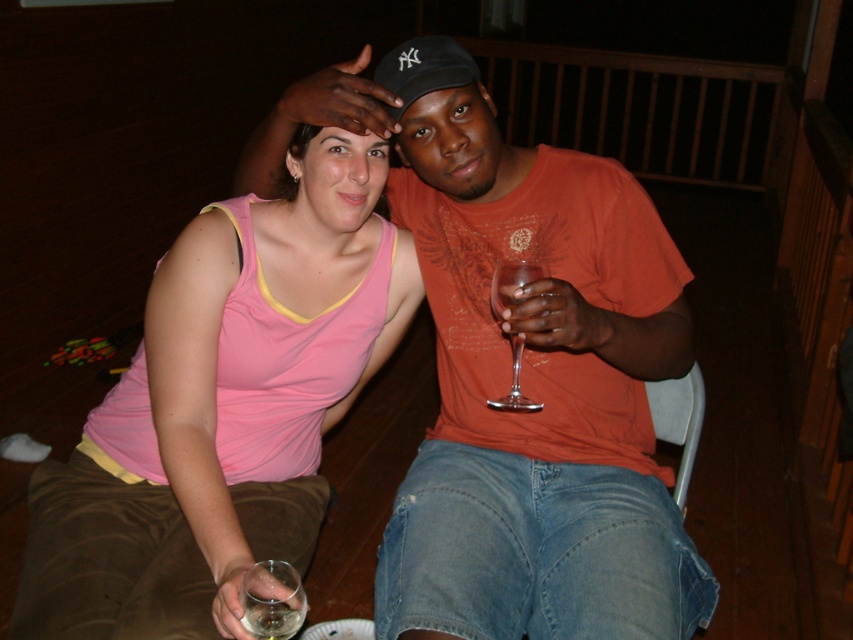
Is clear glass wine glass at lower left bigger than clear glass wine glass at center?

Incorrect, clear glass wine glass at lower left is not larger than clear glass wine glass at center.

Does point (283, 600) lie in front of point (529, 275)?

Yes.

Which is in front, point (276, 612) or point (515, 374)?

Point (276, 612)

Where is `clear glass wine glass at lower left`? This screenshot has width=853, height=640. clear glass wine glass at lower left is located at coordinates (271, 600).

Can you confirm if matte orange t-shirt at center is taller than clear glass wine glass at lower left?

Yes, matte orange t-shirt at center is taller than clear glass wine glass at lower left.

Does matte orange t-shirt at center appear over clear glass wine glass at lower left?

Yes, matte orange t-shirt at center is above clear glass wine glass at lower left.

Is point (555, 497) behind point (260, 589)?

Yes, it is.

The image size is (853, 640). Find the location of `matte orange t-shirt at center`. matte orange t-shirt at center is located at coordinates (521, 369).

Who is more forward, (601, 348) or (140, 458)?

Positioned in front is point (601, 348).

Who is more distant from viewer, (592,385) or (198,269)?

The point (592,385) is behind.

Identify the location of matte orange t-shirt at center. (521, 369).